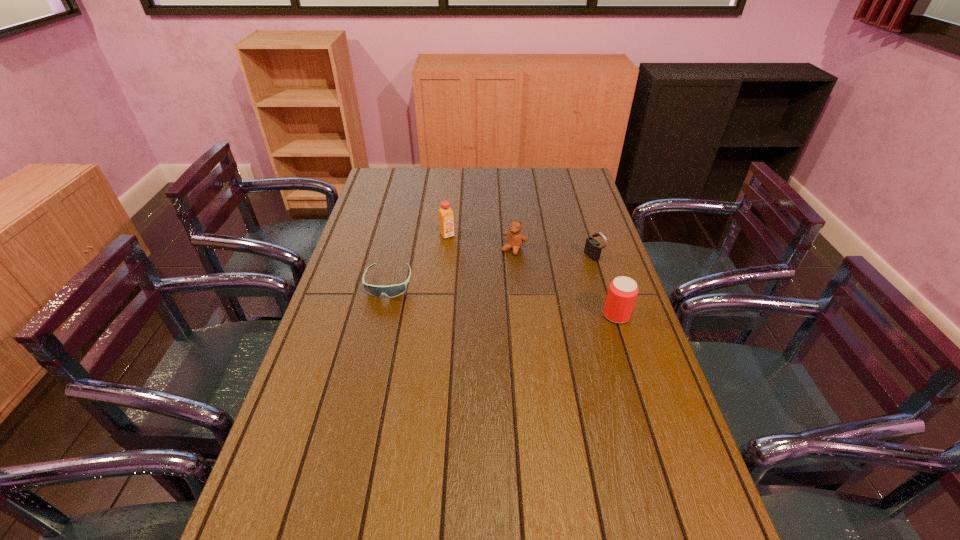
You are a GUI agent. You are given a task and a screenshot of the screen. Output one action in this format:
    pyautogui.click(x=<x>, y=<y>)
    Task: Click on the free space located 0.390m with the keyhole on the front of the padlock
    This screenshot has height=540, width=960.
    Given the screenshot: What is the action you would take?
    pyautogui.click(x=484, y=295)

Where is `free space located 0.100m with the keyhole on the front of the padlock`? This screenshot has width=960, height=540. free space located 0.100m with the keyhole on the front of the padlock is located at coordinates (563, 269).

The height and width of the screenshot is (540, 960). What are the coordinates of `vacant space located 0.260m on the face of the third object from left to right` in the screenshot? It's located at (473, 303).

At what (x,y) coordinates should I click in order to perform the action: click on free space located on the face of the third object from left to right. Please return your answer as a coordinate pair (x, y). Looking at the image, I should click on (501, 266).

You are a GUI agent. You are given a task and a screenshot of the screen. Output one action in this format:
    pyautogui.click(x=<x>, y=<y>)
    Task: Click on the vacant position located 0.080m on the face of the third object from left to right
    
    Given the screenshot: What is the action you would take?
    pyautogui.click(x=499, y=269)

Locate an element on the screen. The height and width of the screenshot is (540, 960). vacant area situated on the front and back of the orange juice is located at coordinates (501, 298).

Find the location of a particular element. This screenshot has width=960, height=540. vacant space positioned on the front and back of the orange juice is located at coordinates (470, 262).

Locate an element on the screen. The image size is (960, 540). vacant space situated on the front and back of the orange juice is located at coordinates (485, 279).

You are a GUI agent. You are given a task and a screenshot of the screen. Output one action in this format:
    pyautogui.click(x=<x>, y=<y>)
    Task: Click on the object located in the left edge section of the desktop
    
    Given the screenshot: What is the action you would take?
    pyautogui.click(x=395, y=290)

You are a GUI agent. You are given a task and a screenshot of the screen. Output one action in this format:
    pyautogui.click(x=<x>, y=<y>)
    Task: Click on the beer can that is at the right edge
    
    Given the screenshot: What is the action you would take?
    pyautogui.click(x=623, y=291)